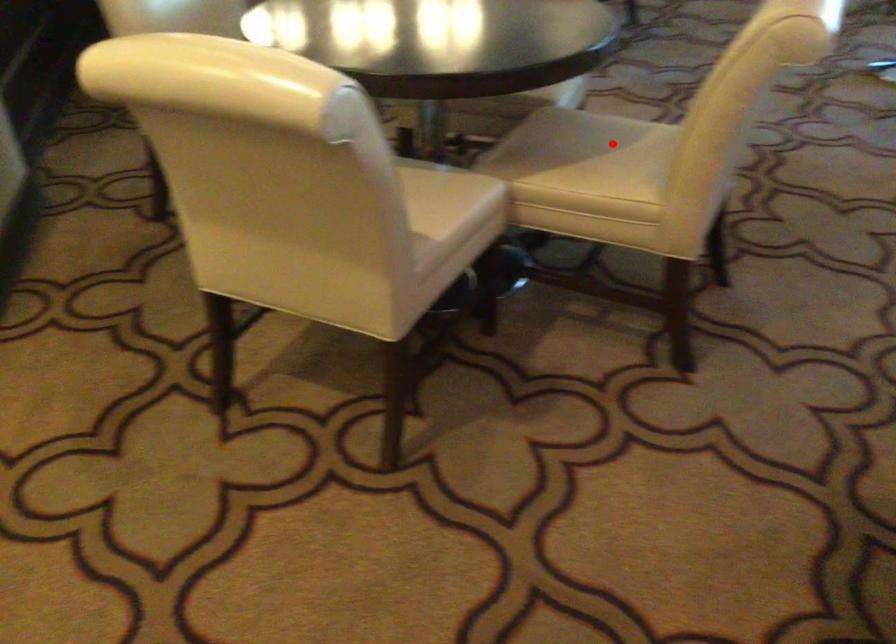
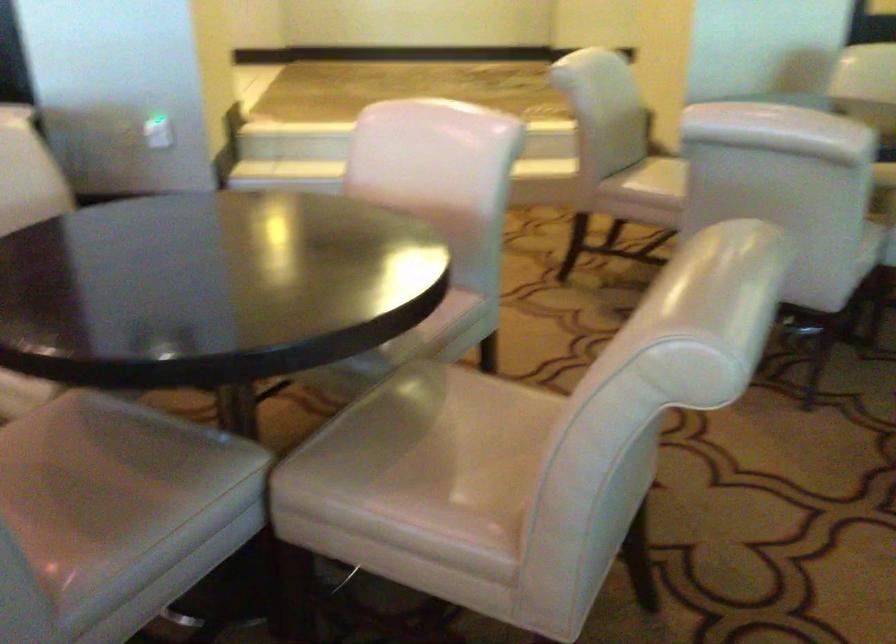
Question: I am providing you with two images of the same scene from different viewpoints. A red point is marked on the first image. Can you still see the location of the red point in image 2?

Choices:
 (A) Yes
 (B) No

Answer: (B)